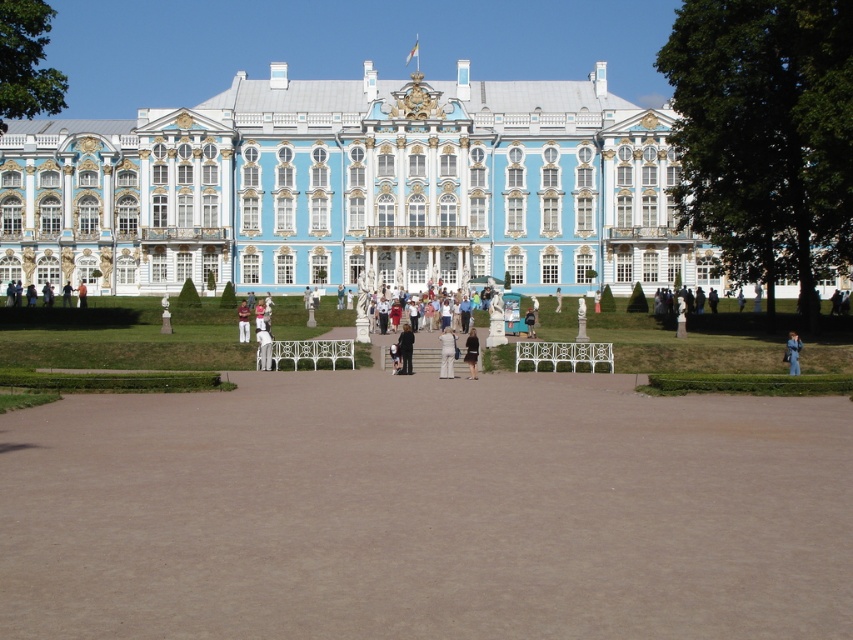
Is dark gray suit at center bigger than white fabric pants at center?

Correct, dark gray suit at center is larger in size than white fabric pants at center.

Is dark gray suit at center thinner than white fabric pants at center?

No, dark gray suit at center is not thinner than white fabric pants at center.

In order to click on dark gray suit at center in this screenshot , I will do `click(405, 348)`.

Image resolution: width=853 pixels, height=640 pixels. What are the coordinates of `dark gray suit at center` in the screenshot? It's located at (405, 348).

Which is above, brown gravel at center or blue painted stone palace at center?

blue painted stone palace at center is above.

Is brown gravel at center to the left of blue painted stone palace at center from the viewer's perspective?

No, brown gravel at center is not to the left of blue painted stone palace at center.

Is point (248, 612) behind point (238, 195)?

No, (248, 612) is closer to viewer.

You are a GUI agent. You are given a task and a screenshot of the screen. Output one action in this format:
    pyautogui.click(x=<x>, y=<y>)
    Task: Click on the brown gravel at center
    
    Given the screenshot: What is the action you would take?
    pyautogui.click(x=426, y=509)

Does dark gray suit at center come behind light brown wooden bench at center?

No, dark gray suit at center is closer to the viewer.

Who is positioned more to the left, dark gray suit at center or light brown wooden bench at center?

light brown wooden bench at center is more to the left.

Locate an element on the screen. The width and height of the screenshot is (853, 640). dark gray suit at center is located at coordinates (405, 348).